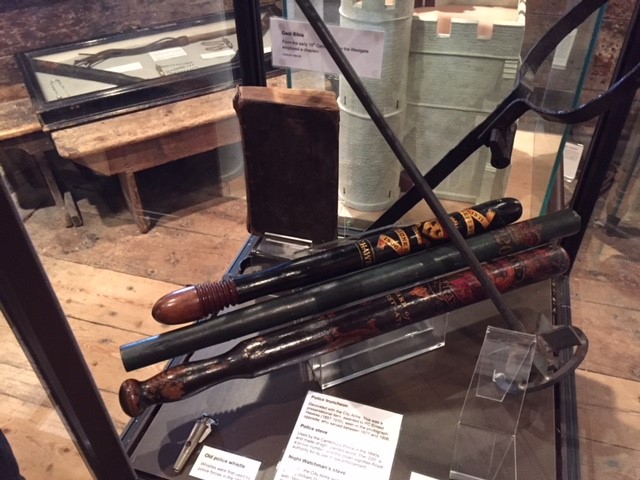
Identify the location of wood table. The width and height of the screenshot is (640, 480). click(x=166, y=140).